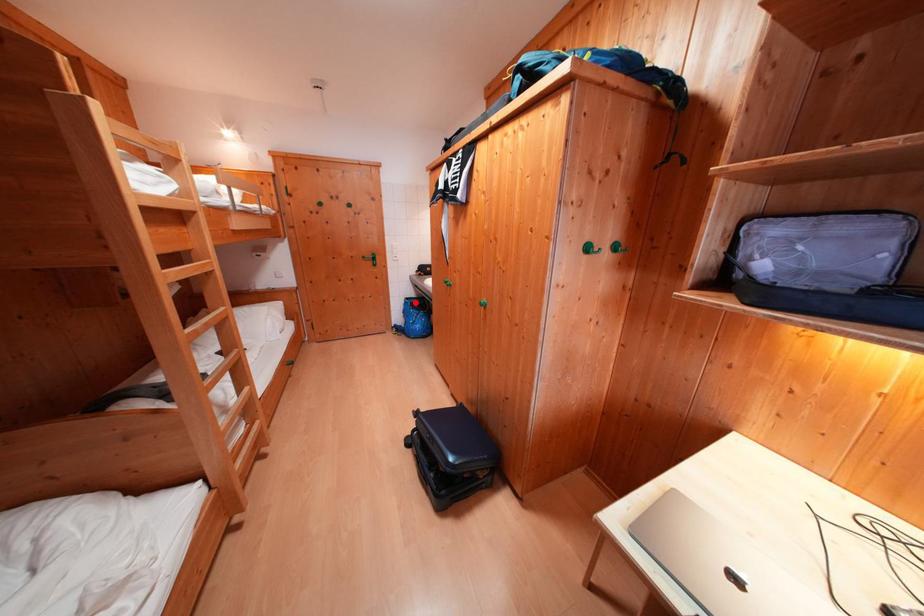
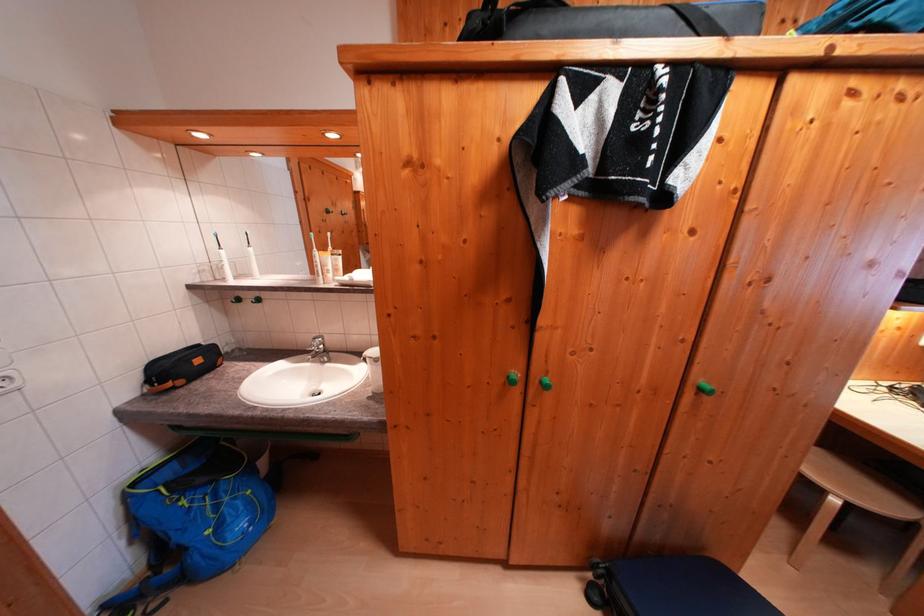
Question: I am providing you with two images of the same scene from different viewpoints. A red point is marked on the first image. Is the red point's position out of view in image 2?

Choices:
 (A) Yes
 (B) No

Answer: (B)